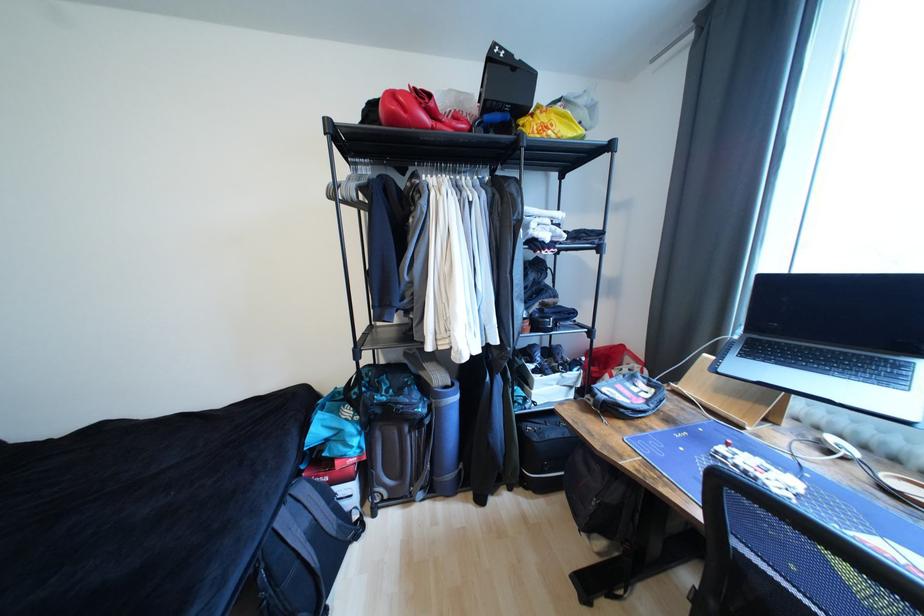
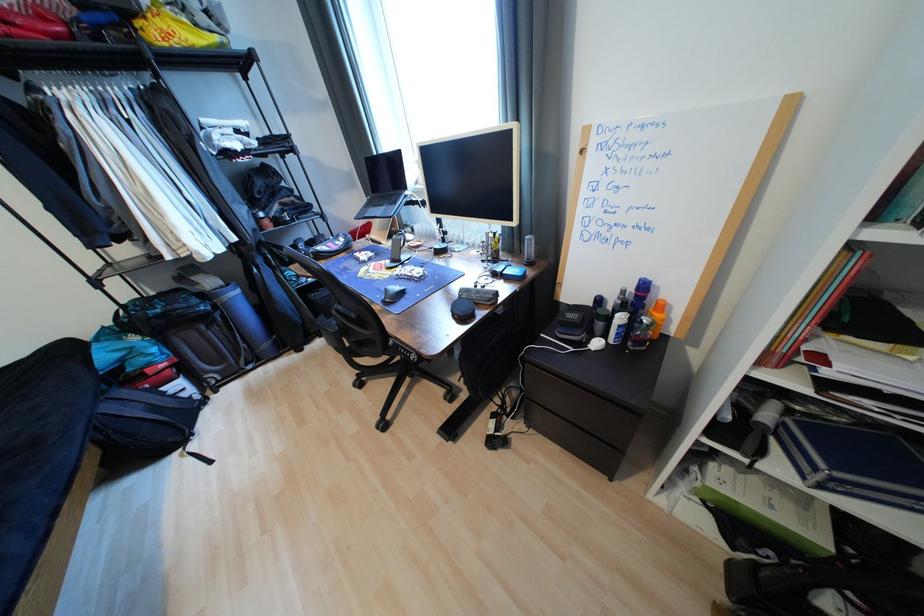
Locate, in the second image, the point that corresponds to (x=831, y=374) in the first image.

(388, 207)